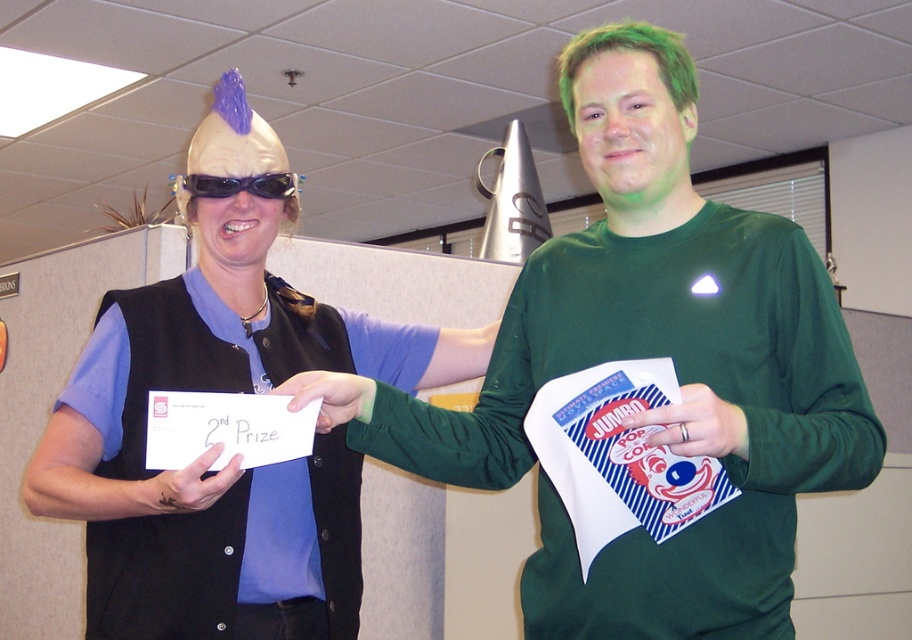
Question: From the image, what is the correct spatial relationship of green matte t-shirt at center in relation to black plastic goggles at upper center?

Choices:
 (A) below
 (B) above

Answer: (A)

Question: Which point is closer to the camera?

Choices:
 (A) (261, 180)
 (B) (115, 467)

Answer: (B)

Question: Based on their relative distances, which object is nearer to the green matte t-shirt at center?

Choices:
 (A) matte black vest at center
 (B) black plastic goggles at upper center

Answer: (A)

Question: Does green matte t-shirt at center come behind black plastic goggles at upper center?

Choices:
 (A) yes
 (B) no

Answer: (B)

Question: Does green matte t-shirt at center have a lesser width compared to matte black vest at center?

Choices:
 (A) no
 (B) yes

Answer: (A)

Question: Which of the following is the closest to the observer?

Choices:
 (A) green matte t-shirt at center
 (B) matte black vest at center

Answer: (A)